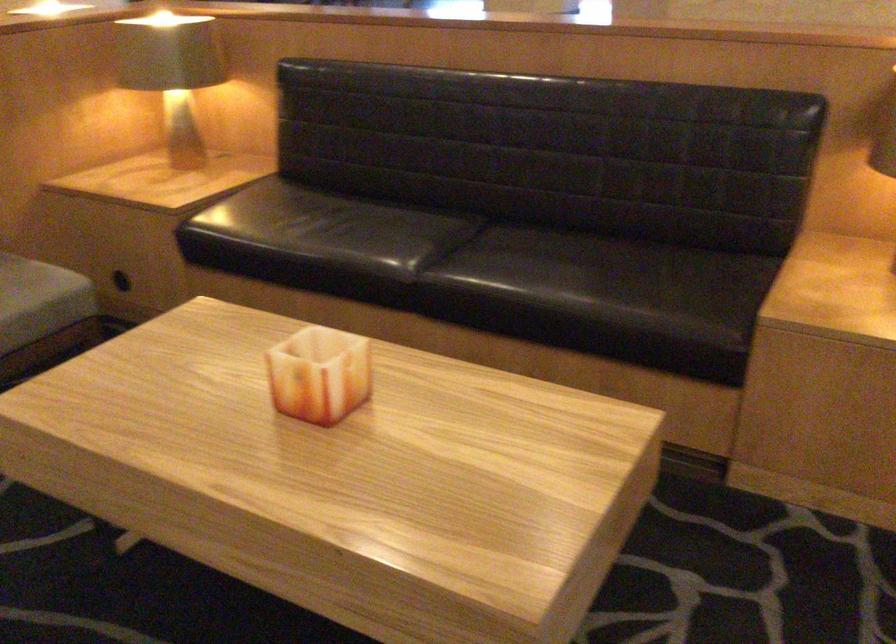
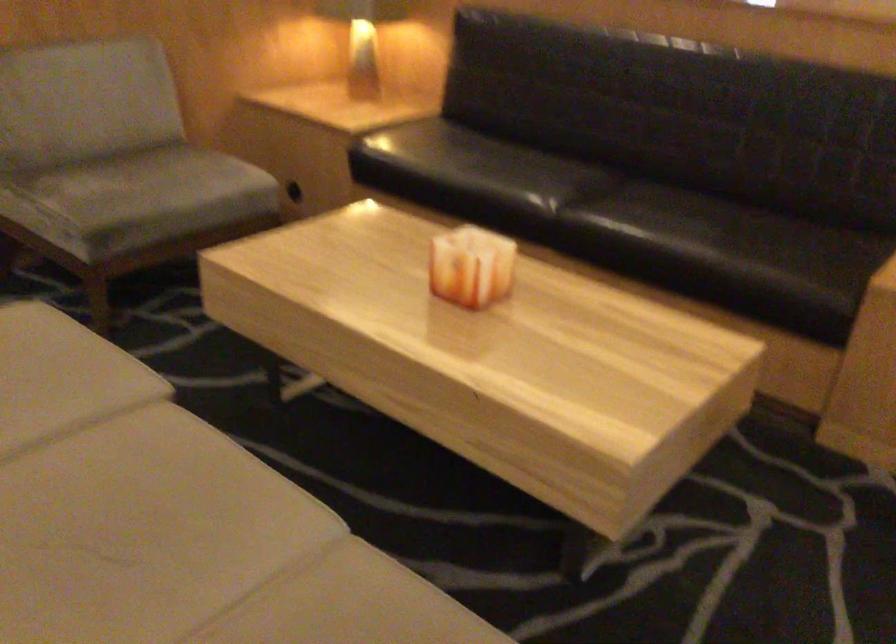
Question: Which direction would the cameraman need to move to produce the second image? Reply with the corresponding letter.

Choices:
 (A) Left
 (B) Right
 (C) Forward
 (D) Backward

Answer: (D)